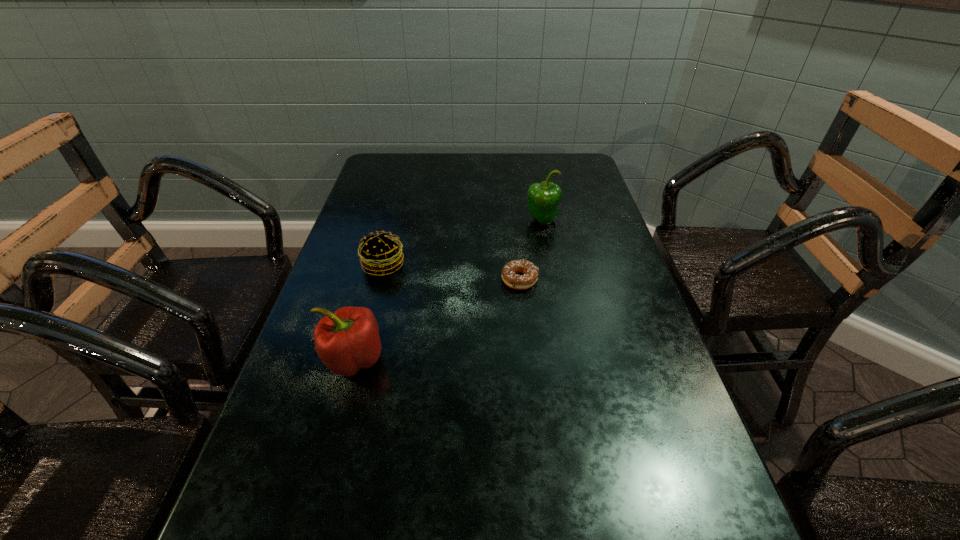
This screenshot has width=960, height=540. I want to click on free point between the second shortest object and the farther bell pepper, so click(x=463, y=243).

You are a GUI agent. You are given a task and a screenshot of the screen. Output one action in this format:
    pyautogui.click(x=<x>, y=<y>)
    Task: Click on the empty space between the third tallest object and the doughnut
    This screenshot has width=960, height=540.
    Given the screenshot: What is the action you would take?
    pyautogui.click(x=451, y=272)

Find the location of `free space between the patty and the taller bell pepper`. free space between the patty and the taller bell pepper is located at coordinates (463, 243).

In order to click on free space between the doughnut and the farther bell pepper in this screenshot , I will do `click(531, 251)`.

I want to click on empty space that is in between the taller bell pepper and the doughnut, so click(x=531, y=251).

Where is `vacant area that lies between the shortest object and the patty`? Image resolution: width=960 pixels, height=540 pixels. vacant area that lies between the shortest object and the patty is located at coordinates (451, 272).

At what (x,y) coordinates should I click in order to perform the action: click on object that ranks as the third closest to the doughnut. Please return your answer as a coordinate pair (x, y). This screenshot has height=540, width=960. Looking at the image, I should click on (347, 340).

Identify which object is located as the second nearest to the tallest object. Please provide its 2D coordinates. Your answer should be formatted as a tuple, i.e. [(x, y)], where the tuple contains the x and y coordinates of a point satisfying the conditions above.

[(381, 253)]